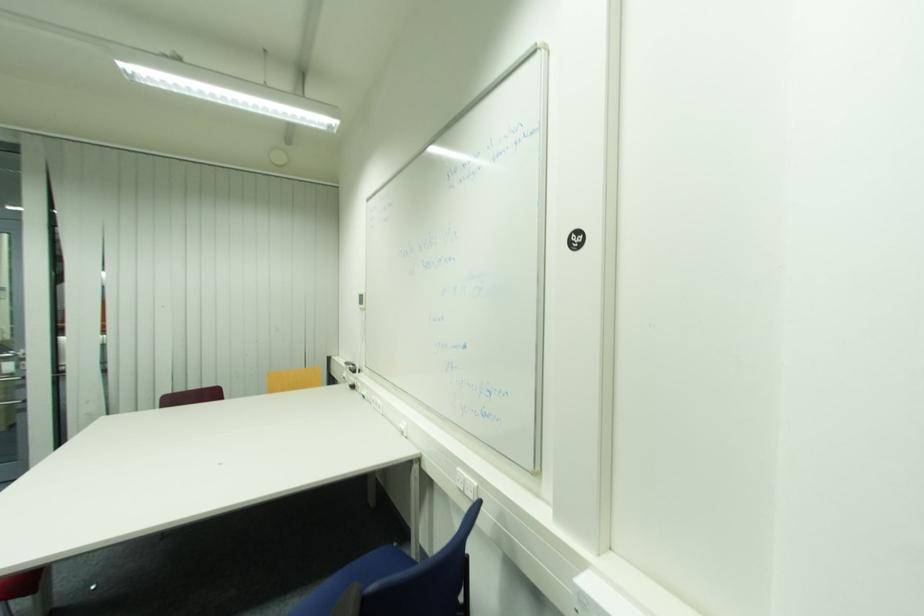
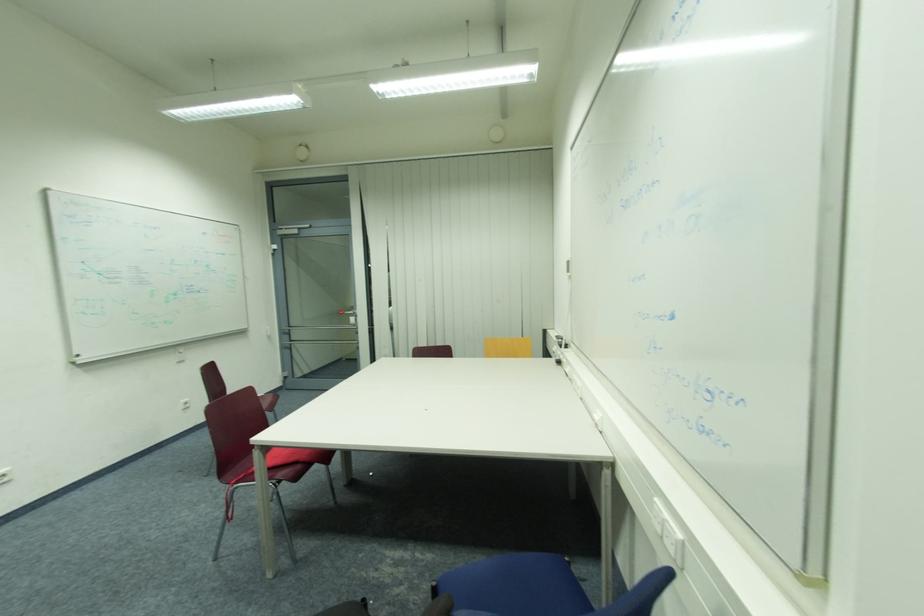
Where in the second image is the point corresponding to point (370, 377) from the first image?

(578, 352)